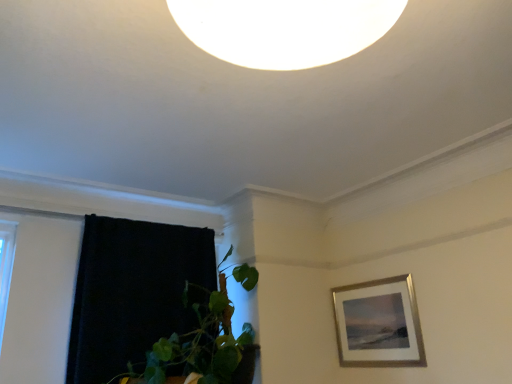
Question: Would you say green leafy plant at lower left is to the left or to the right of silver/metallic picture frame at upper right in the picture?

Choices:
 (A) right
 (B) left

Answer: (B)

Question: In the image, is green leafy plant at lower left positioned in front of or behind silver/metallic picture frame at upper right?

Choices:
 (A) front
 (B) behind

Answer: (A)

Question: Which object is positioned closest to the silver/metallic picture frame at upper right?

Choices:
 (A) black velvet curtain at left
 (B) green leafy plant at lower left

Answer: (B)

Question: Which of these objects is positioned closest to the silver/metallic picture frame at upper right?

Choices:
 (A) black velvet curtain at left
 (B) green leafy plant at lower left

Answer: (B)